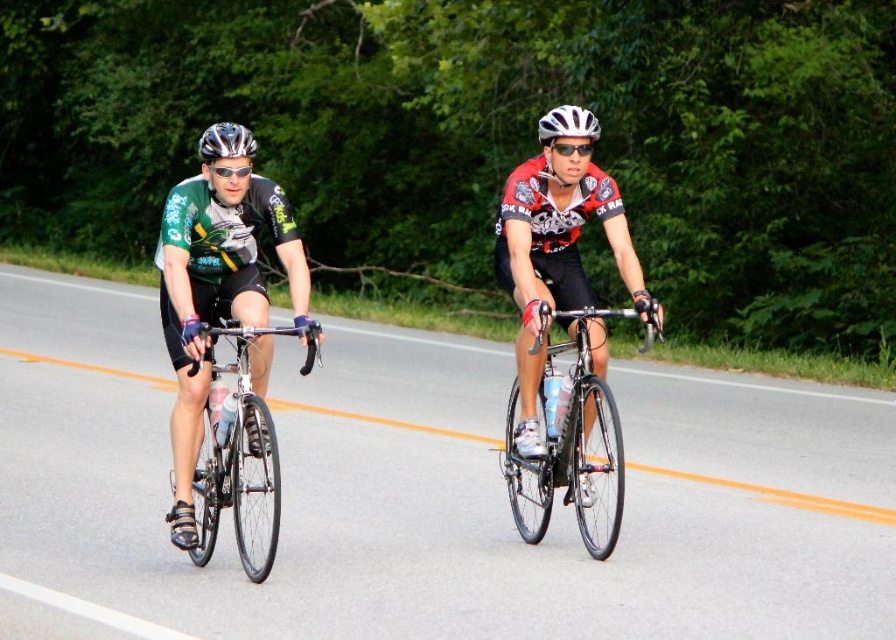
You are a cyclist participating in a race and you notice two points marked on the road ahead. The first point is at coordinate point (x=587, y=486) and the second is at point (x=231, y=182). Which point should you reach first while moving forward?

Point (x=231, y=182) should be reached first because it is in front of point (x=587, y=486).

You are a photographer positioned at point (567, 438). You want to capture a photo of the shiny black frame at center. What object should you focus on?

The shiny black frame at center is located at point (567, 438), so you should focus on the shiny black frame at center to capture it in your photo.

You are a photographer trying to capture both helmets in a single shot. Since the matte black helmet at left is smaller and the shiny silver helmet at upper center is larger, which helmet would appear closer to the camera?

The matte black helmet at left appears closer to the camera because it is smaller than the shiny silver helmet at upper center.